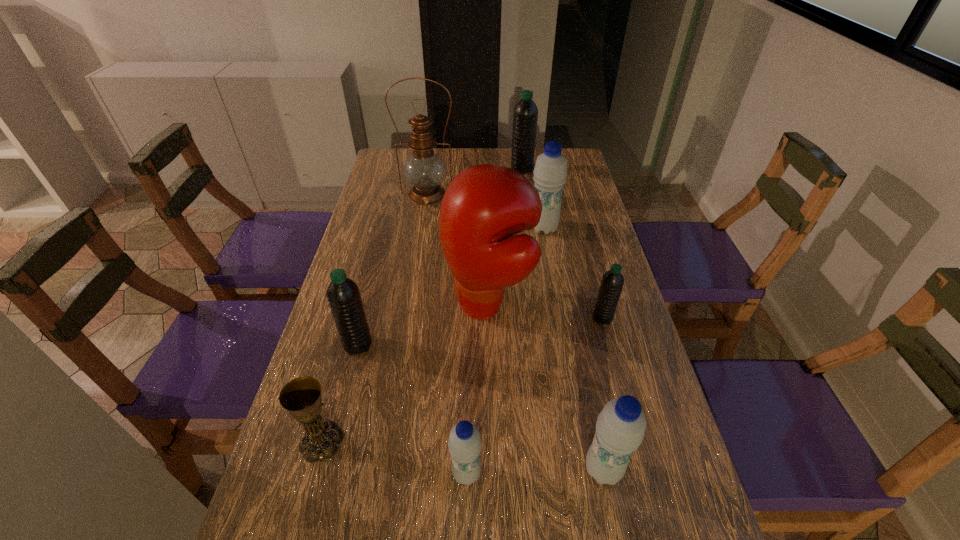
I want to click on oil lamp, so click(424, 170).

The width and height of the screenshot is (960, 540). Identify the location of red boxing glove. (484, 205).

I want to click on the second black water bottle from right to left, so (x=525, y=117).

You are a GUI agent. You are given a task and a screenshot of the screen. Output one action in this format:
    pyautogui.click(x=<x>, y=<y>)
    Task: Click on the farthest object
    This screenshot has width=960, height=540.
    Given the screenshot: What is the action you would take?
    pyautogui.click(x=525, y=117)

Locate an element on the screen. the seventh nearest object is located at coordinates (550, 172).

Where is `the biggest blue water bottle`? Image resolution: width=960 pixels, height=540 pixels. the biggest blue water bottle is located at coordinates (550, 172).

You are a GUI agent. You are given a task and a screenshot of the screen. Output one action in this format:
    pyautogui.click(x=<x>, y=<y>)
    Task: Click on the second biggest black water bottle
    The image size is (960, 540).
    Given the screenshot: What is the action you would take?
    click(x=343, y=295)

The width and height of the screenshot is (960, 540). Find the location of `the leftmost black water bottle`. the leftmost black water bottle is located at coordinates (343, 295).

I want to click on the second biggest blue water bottle, so pos(620,428).

Identify the location of the third farthest water bottle. The image size is (960, 540). (612, 282).